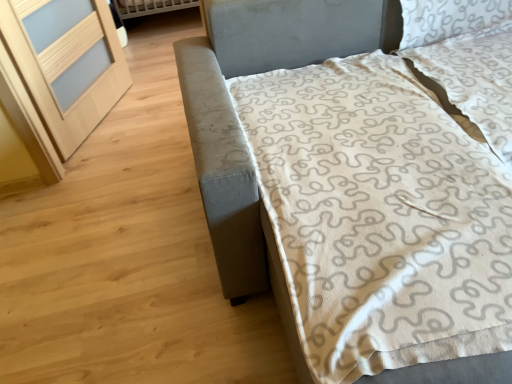
The height and width of the screenshot is (384, 512). Describe the element at coordinates (66, 63) in the screenshot. I see `light wood screen door at left` at that location.

Identify the location of textured gray bed at right. (239, 121).

Identify the location of white textured pillow at upper right. coord(476,79).

Is textured gray bed at right a part of light wood screen door at left?

Answer: Definitely not — textured gray bed at right is not inside light wood screen door at left.

Which is behind, point (106, 19) or point (240, 2)?

The point (106, 19) is more distant.

Which is more to the left, light wood screen door at left or textured gray bed at right?

From the viewer's perspective, light wood screen door at left appears more on the left side.

Is light wood screen door at left placed right next to textured gray bed at right?

light wood screen door at left and textured gray bed at right are not in contact.

From a real-world perspective, is white textured pillow at upper right physically above light wood screen door at left?

Yes, from a real-world perspective, white textured pillow at upper right is above light wood screen door at left.

Is white textured pillow at upper right aimed at light wood screen door at left?

No, white textured pillow at upper right is not oriented towards light wood screen door at left.

Considering the relative sizes of white textured pillow at upper right and light wood screen door at left in the image provided, is white textured pillow at upper right wider than light wood screen door at left?

Correct, the width of white textured pillow at upper right exceeds that of light wood screen door at left.

From a real-world perspective, does white textured pillow at upper right sit lower than textured gray bed at right?

Incorrect, from a real-world perspective, white textured pillow at upper right is higher than textured gray bed at right.

Can you confirm if white textured pillow at upper right is positioned to the left of textured gray bed at right?

No, white textured pillow at upper right is not to the left of textured gray bed at right.

What's the angular difference between white textured pillow at upper right and textured gray bed at right's facing directions?

2.19 degrees separate the facing orientations of white textured pillow at upper right and textured gray bed at right.

Is white textured pillow at upper right oriented away from textured gray bed at right?

Yes, white textured pillow at upper right is positioned with its back facing textured gray bed at right.

Which is nearer, (242, 270) or (447, 60)?

Point (242, 270).

The image size is (512, 384). I want to click on pillow positioned vertically above the textured gray bed at right (from a real-world perspective), so click(x=476, y=79).

Is textured gray bed at right located outside white textured pillow at upper right?

Yes.

Based on the photo, is light wood screen door at left in contact with white textured pillow at upper right?

No, light wood screen door at left is not next to white textured pillow at upper right.

From a real-world perspective, relative to white textured pillow at upper right, is light wood screen door at left vertically above or below?

In terms of real-world spatial position, light wood screen door at left is below white textured pillow at upper right.

How many degrees apart are the facing directions of light wood screen door at left and white textured pillow at upper right?

There is a 68.2-degree angle between the facing directions of light wood screen door at left and white textured pillow at upper right.

Which is in front, light wood screen door at left or white textured pillow at upper right?

white textured pillow at upper right.

Based on the photo, in the image, is textured gray bed at right on the left side or the right side of light wood screen door at left?

In the image, textured gray bed at right appears on the right side of light wood screen door at left.

Is textured gray bed at right thinner than light wood screen door at left?

No, textured gray bed at right is not thinner than light wood screen door at left.

Does textured gray bed at right touch light wood screen door at left?

No, textured gray bed at right is not next to light wood screen door at left.

The width and height of the screenshot is (512, 384). I want to click on bed in front of the light wood screen door at left, so click(x=239, y=121).

Where is `pillow on the right of light wood screen door at left`? pillow on the right of light wood screen door at left is located at coordinates (476, 79).

Which object lies nearer to the anchor point white textured pillow at upper right, textured gray bed at right or light wood screen door at left?

textured gray bed at right lies closer to white textured pillow at upper right than the other object.

Estimate the real-world distances between objects in this image. Which object is closer to light wood screen door at left, white textured pillow at upper right or textured gray bed at right?

The object closer to light wood screen door at left is textured gray bed at right.

From the image, which object appears to be farther from textured gray bed at right, white textured pillow at upper right or light wood screen door at left?

The object further to textured gray bed at right is light wood screen door at left.

Based on their spatial positions, is light wood screen door at left or white textured pillow at upper right closer to textured gray bed at right?

white textured pillow at upper right.

From the picture: Based on their spatial positions, is textured gray bed at right or white textured pillow at upper right closer to light wood screen door at left?

textured gray bed at right lies closer to light wood screen door at left than the other object.

From the image, which object appears to be nearer to white textured pillow at upper right, light wood screen door at left or textured gray bed at right?

textured gray bed at right.

Locate an element on the screen. bed between light wood screen door at left and white textured pillow at upper right is located at coordinates (239, 121).